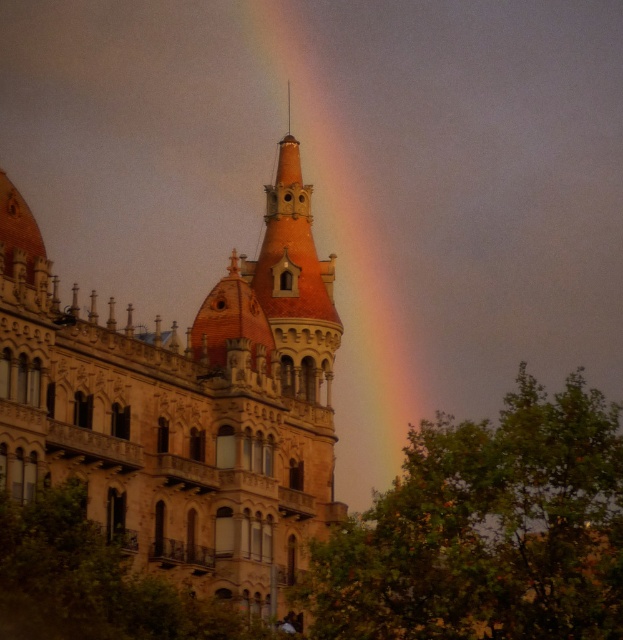
Question: Does brown stone palace at center have a lesser width compared to rainbow at upper center?

Choices:
 (A) yes
 (B) no

Answer: (A)

Question: Which object is closer to the camera taking this photo?

Choices:
 (A) rainbow at upper center
 (B) brown stone palace at center
 (C) green leafy tree at lower right

Answer: (C)

Question: Which of these objects is positioned farthest from the green leafy tree at lower right?

Choices:
 (A) rainbow at upper center
 (B) brown stone palace at center

Answer: (A)

Question: Is brown stone palace at center smaller than green leafy tree at lower right?

Choices:
 (A) yes
 (B) no

Answer: (A)

Question: Can you confirm if brown stone palace at center is positioned below rainbow at upper center?

Choices:
 (A) yes
 (B) no

Answer: (A)

Question: Among these points, which one is farthest from the camera?

Choices:
 (A) (323, 273)
 (B) (356, 481)
 (C) (530, 419)

Answer: (B)